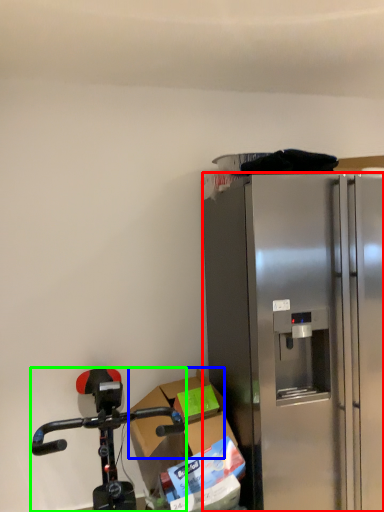
Question: Which object is the farthest from refrigerator (highlighted by a red box)? Choose among these: box (highlighted by a blue box) or bicycle (highlighted by a green box).

Choices:
 (A) box
 (B) bicycle

Answer: (B)